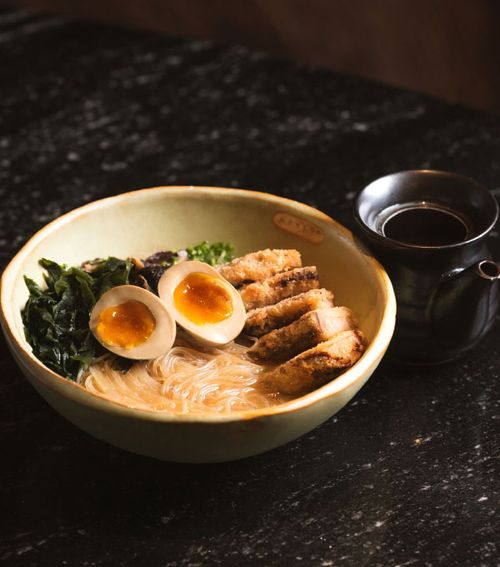
Identify the location of kettle. (413, 280).